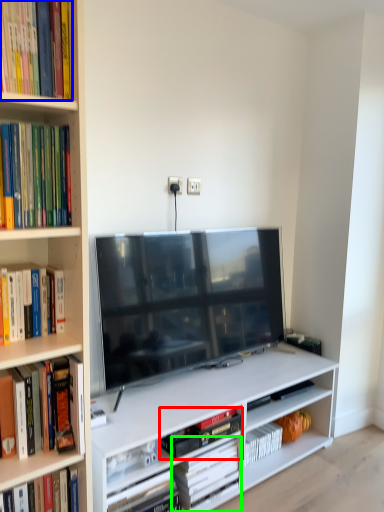
Question: Which object is the closest to the book (highlighted by a red box)? Choose among these: book (highlighted by a blue box) or book (highlighted by a green box).

Choices:
 (A) book
 (B) book

Answer: (B)